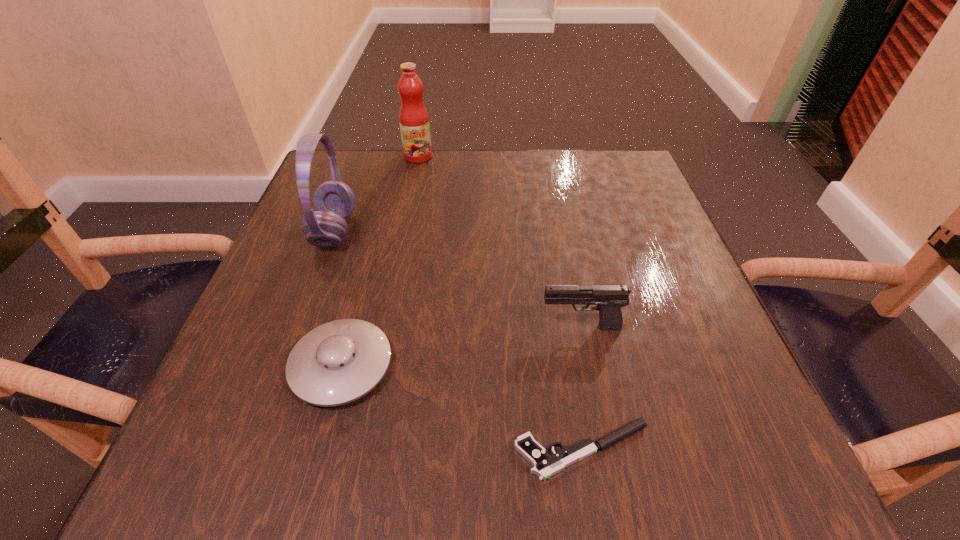
In order to click on the farthest object in this screenshot , I will do [414, 120].

Where is `headset`? The height and width of the screenshot is (540, 960). headset is located at coordinates (334, 201).

Where is `the taller pistol`? The image size is (960, 540). the taller pistol is located at coordinates (609, 299).

The height and width of the screenshot is (540, 960). Find the location of `the third tallest object`. the third tallest object is located at coordinates (609, 299).

Locate an element on the screen. The width and height of the screenshot is (960, 540). the second shortest object is located at coordinates (338, 362).

The image size is (960, 540). I want to click on the shorter pistol, so click(545, 466).

The height and width of the screenshot is (540, 960). Identify the location of the shortest object. (545, 466).

Where is `vacant region located on the front label of the farthest object`? This screenshot has width=960, height=540. vacant region located on the front label of the farthest object is located at coordinates (404, 228).

Image resolution: width=960 pixels, height=540 pixels. In order to click on vacant space located 0.180m on the headband and ear cups of the fourth nearest object in this screenshot , I will do `click(444, 231)`.

Locate an element on the screen. The width and height of the screenshot is (960, 540). vacant area situated 0.240m aim along the barrel of the taller pistol is located at coordinates (394, 327).